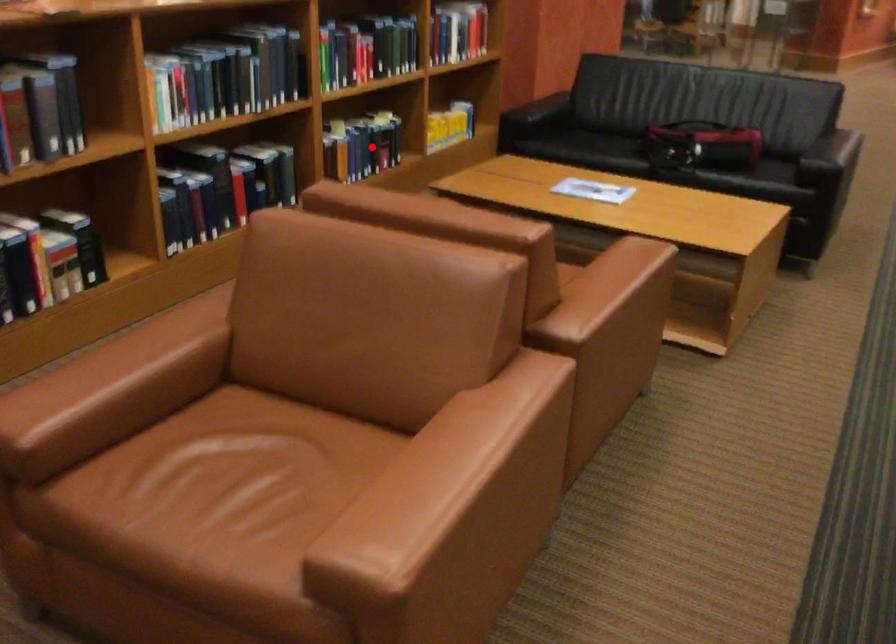
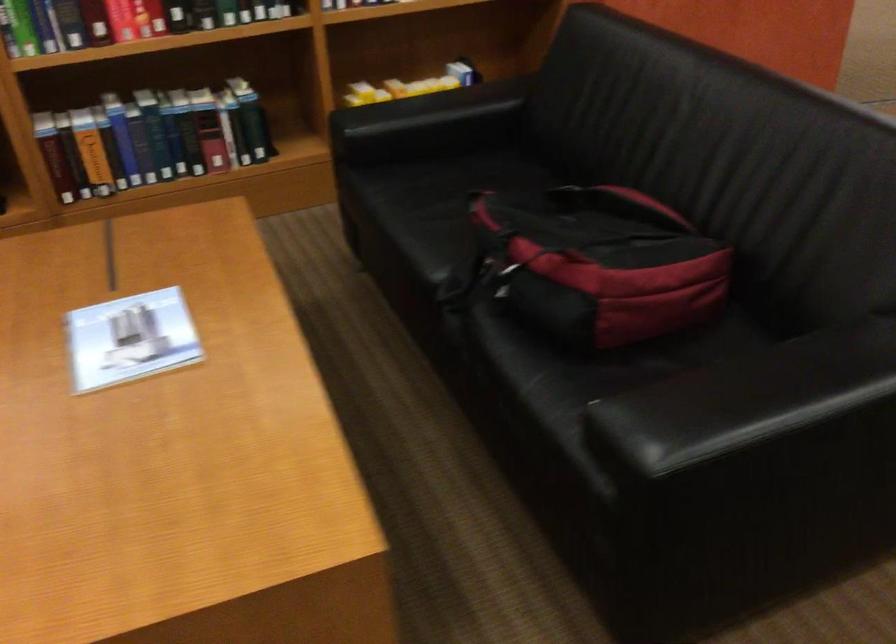
The point at the highlighted location is marked in the first image. Where is the corresponding point in the second image?

(151, 138)